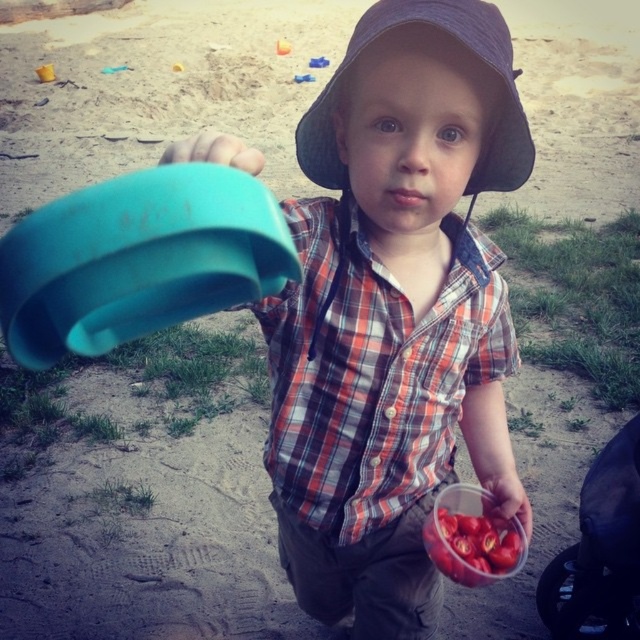
You are a photographer trying to capture the child in the scene. If you want to focus on the plaid cotton shirt at center without the teal plastic cup at upper left appearing in the foreground, what should you do?

The teal plastic cup at upper left is behind the plaid cotton shirt at center, so adjusting the camera angle to position the plaid cotton shirt at center in front can ensure the teal plastic cup at upper left remains out of the foreground.

You are a parent trying to hand your child a snack. The plaid cotton shirt at center is on your child, and you see the teal plastic cup at upper left nearby. If the snack is 3 inches wide, can you place it between them without moving either?

The plaid cotton shirt at center and teal plastic cup at upper left are 16.22 inches apart from each other. Since the snack is only 3 inches wide, there is enough space to place it between them without moving either.